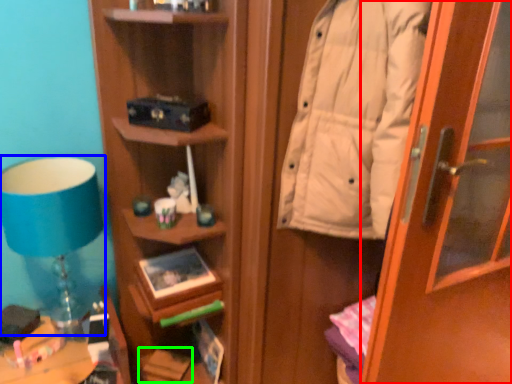
Question: Based on their relative distances, which object is farther from door (highlighted by a red box)? Choose from table lamp (highlighted by a blue box) and book (highlighted by a green box).

Choices:
 (A) table lamp
 (B) book

Answer: (B)